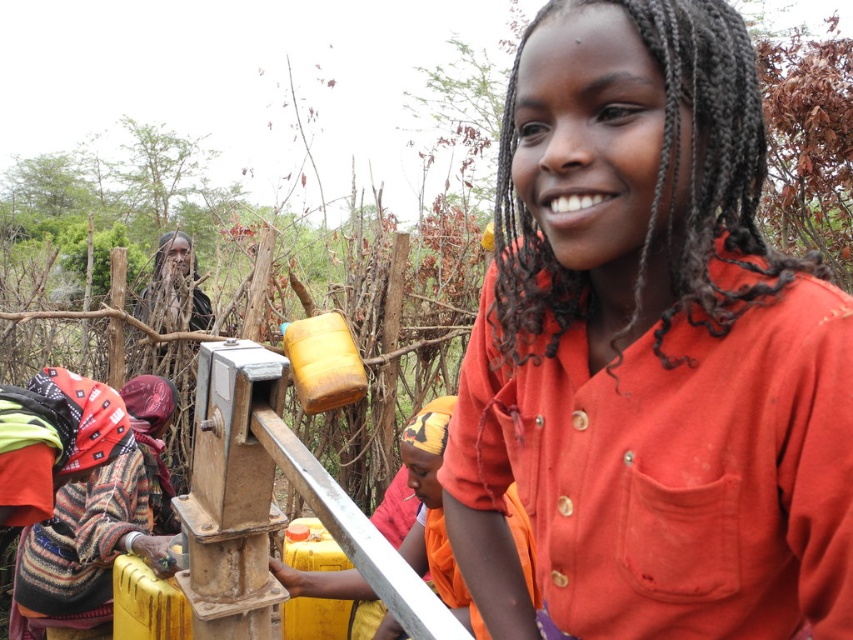
Question: Which point is closer to the camera?

Choices:
 (A) orange cotton shirt at center
 (B) striped woolen sweater at lower left

Answer: (A)

Question: Is orange cotton shirt at center to the left of striped woolen sweater at lower left from the viewer's perspective?

Choices:
 (A) yes
 (B) no

Answer: (B)

Question: Is orange cotton shirt at center to the left of striped woolen sweater at lower left from the viewer's perspective?

Choices:
 (A) yes
 (B) no

Answer: (B)

Question: Is the position of orange cotton shirt at center less distant than that of striped woolen sweater at lower left?

Choices:
 (A) no
 (B) yes

Answer: (B)

Question: Which point is closer to the camera?

Choices:
 (A) striped woolen sweater at lower left
 (B) orange cotton shirt at center

Answer: (B)

Question: Which object is farther from the camera taking this photo?

Choices:
 (A) striped woolen sweater at lower left
 (B) orange cotton shirt at center

Answer: (A)